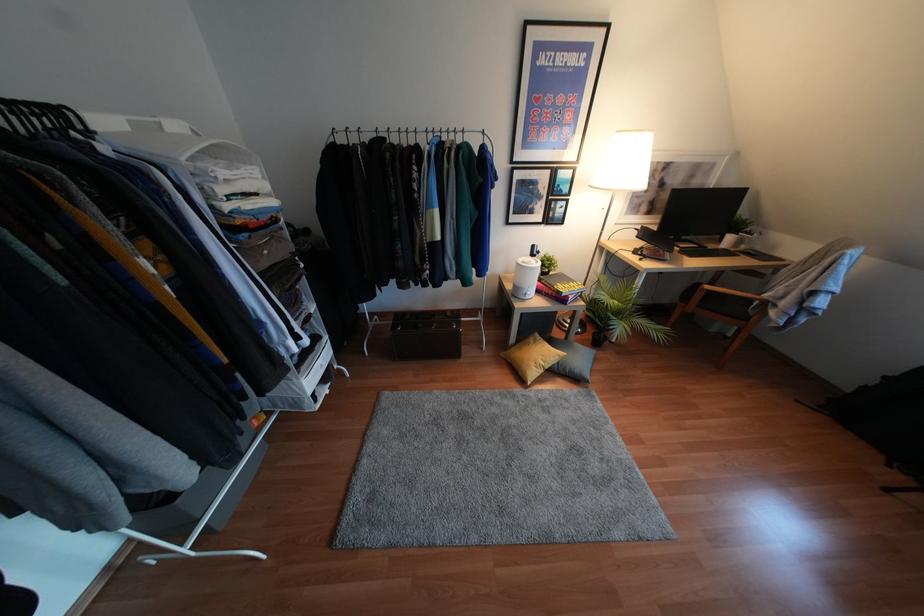
Find where to grasp the wooden chair armrest. Please return your answer as a coordinate pair (x, y).

(728, 292)